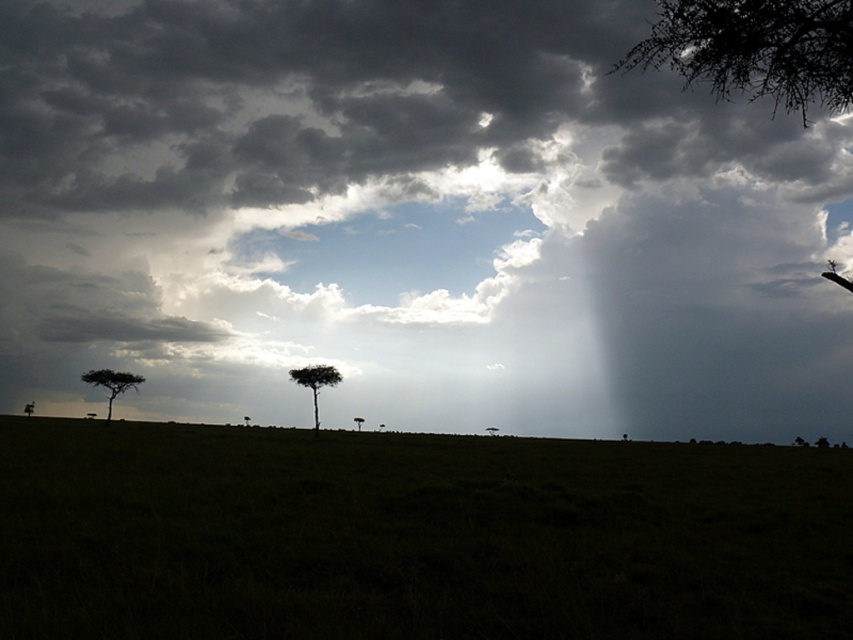
Who is more distant from viewer, (405, 301) or (325, 372)?

Positioned behind is point (325, 372).

Who is shorter, dark gray cloud at upper center or green matte tree at center?

green matte tree at center

The image size is (853, 640). Find the location of `dark gray cloud at upper center`. dark gray cloud at upper center is located at coordinates (410, 221).

Can you confirm if dark green leafy tree at upper right is bigger than green matte tree at center?

Yes.

Does point (801, 48) lie behind point (305, 365)?

That is False.

In order to click on dark green leafy tree at upper right in this screenshot , I will do `click(753, 49)`.

Is point (804, 45) closer to viewer compared to point (123, 387)?

That is True.

Does dark green leafy tree at upper right appear over silhouette leafy tree at lower left?

Indeed, dark green leafy tree at upper right is positioned over silhouette leafy tree at lower left.

Where is `dark green leafy tree at upper right`? This screenshot has height=640, width=853. dark green leafy tree at upper right is located at coordinates [x=753, y=49].

Find the location of `dark green leafy tree at upper right`. dark green leafy tree at upper right is located at coordinates (753, 49).